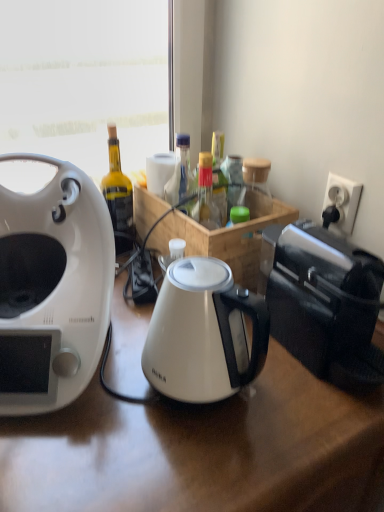
Question: Relative to white glossy electric kettle at center, is translucent glass bottle at center in front or behind?

Choices:
 (A) behind
 (B) front

Answer: (A)

Question: Visually, is translucent glass bottle at center positioned to the left or to the right of white glossy electric kettle at center?

Choices:
 (A) left
 (B) right

Answer: (A)

Question: Estimate the real-world distances between objects in this image. Which object is farther from the translucent glass bottle at center?

Choices:
 (A) white glossy coffee maker at left
 (B) white glossy electric kettle at center
 (C) black plastic toaster at right
 (D) white plastic power outlet at upper right

Answer: (A)

Question: Based on their relative distances, which object is farther from the white glossy coffee maker at left?

Choices:
 (A) white plastic power outlet at upper right
 (B) white glossy electric kettle at center
 (C) translucent glass bottle at center
 (D) black plastic toaster at right

Answer: (A)